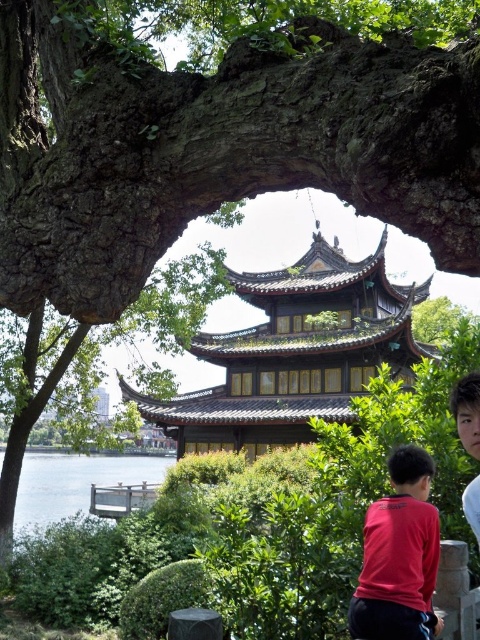
Is brown wooden pagoda at center positioned behind red matte shirt at lower right?

Yes, it is behind red matte shirt at lower right.

Between brown wooden pagoda at center and red matte shirt at lower right, which one has more height?

brown wooden pagoda at center

Describe the element at coordinates (295, 353) in the screenshot. I see `brown wooden pagoda at center` at that location.

Find the location of `brown wooden pagoda at center`. brown wooden pagoda at center is located at coordinates (295, 353).

Between red matte shirt at lower right and red shirt at lower right, which one has more height?

With more height is red matte shirt at lower right.

At what (x,y) coordinates should I click in order to perform the action: click on red matte shirt at lower right. Please return your answer as a coordinate pair (x, y). Looking at the image, I should click on (398, 556).

Where is `red matte shirt at lower right`? The width and height of the screenshot is (480, 640). red matte shirt at lower right is located at coordinates (398, 556).

Where is `red matte shirt at lower right`? red matte shirt at lower right is located at coordinates (398, 556).

Who is higher up, red matte shirt at lower right or clear water at lower left?

red matte shirt at lower right

Can you confirm if red matte shirt at lower right is positioned below clear water at lower left?

No, red matte shirt at lower right is not below clear water at lower left.

At what (x,y) coordinates should I click in order to perform the action: click on red matte shirt at lower right. Please return your answer as a coordinate pair (x, y). This screenshot has width=480, height=640. Looking at the image, I should click on (398, 556).

This screenshot has width=480, height=640. I want to click on red matte shirt at lower right, so click(x=398, y=556).